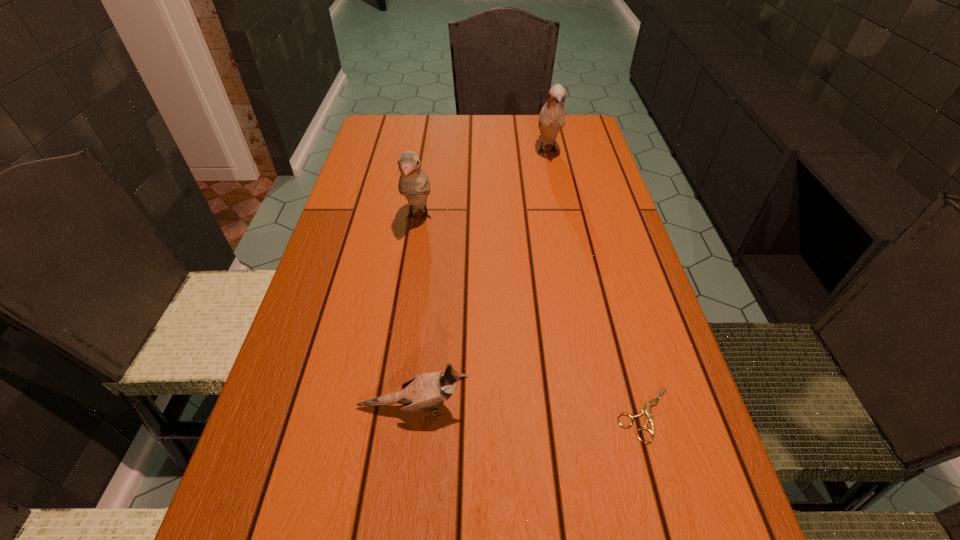
This screenshot has width=960, height=540. I want to click on object that is the closest to the shears, so click(424, 392).

Locate an element on the screen. bird that is the nearest to the third nearest object is located at coordinates (552, 117).

Point out which bird is positioned as the second nearest to the second farthest bird. Please provide its 2D coordinates. Your answer should be formatted as a tuple, i.e. [(x, y)], where the tuple contains the x and y coordinates of a point satisfying the conditions above.

[(424, 392)]

At what (x,y) coordinates should I click in order to perform the action: click on vacant space that satisfies the following two spatial constraints: 1. at the face of the second farthest object; 2. on the right side of the shears. Please return your answer as a coordinate pair (x, y). This screenshot has width=960, height=540. Looking at the image, I should click on (388, 414).

Locate an element on the screen. This screenshot has height=540, width=960. free region that satisfies the following two spatial constraints: 1. at the beak of the farthest object; 2. on the right side of the shears is located at coordinates (601, 414).

Where is `free space that satisfies the following two spatial constraints: 1. at the beak of the shears; 2. on the left side of the farthest object`? The image size is (960, 540). free space that satisfies the following two spatial constraints: 1. at the beak of the shears; 2. on the left side of the farthest object is located at coordinates (601, 414).

At what (x,y) coordinates should I click in order to perform the action: click on vacant region that satisfies the following two spatial constraints: 1. at the beak of the farthest bird; 2. at the face of the shortest bird. Please return your answer as a coordinate pair (x, y). The width and height of the screenshot is (960, 540). Looking at the image, I should click on (600, 407).

This screenshot has width=960, height=540. Find the location of `free location that satisfies the following two spatial constraints: 1. at the face of the shortest bird; 2. on the left side of the shortest object`. free location that satisfies the following two spatial constraints: 1. at the face of the shortest bird; 2. on the left side of the shortest object is located at coordinates (413, 414).

What are the coordinates of `vacant space that satisfies the following two spatial constraints: 1. at the beak of the rightmost bird; 2. at the face of the nearest bird` in the screenshot? It's located at (600, 407).

Locate an element on the screen. The width and height of the screenshot is (960, 540). free space that satisfies the following two spatial constraints: 1. at the face of the third nearest object; 2. on the left side of the shortest object is located at coordinates (388, 414).